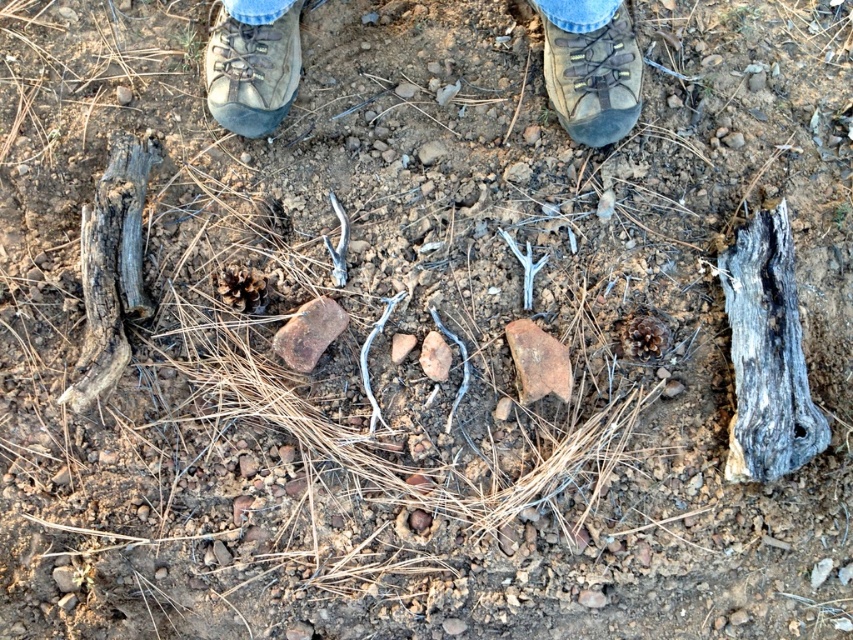
You are wearing the brown leather boots at center and want to pick up the gray weathered log at left. Can you reach it without moving your feet?

The gray weathered log at left is behind the brown leather boots at center, so you cannot reach it without moving your feet because it is out of your immediate reach from your current position.

You are standing at the camera position and see the gray weathered log at left. If you take a step forward, will the log be closer to you?

The gray weathered log at left is 5.66 feet away from the camera. If you step forward, you will be closer to the log, so yes, the log will appear closer to you.

You are a hiker who wants to place a small backpack between the brown leather boots at center and the gray weathered log at left. The backpack is 3 feet long. Will there be enough space between the two objects to fit it?

The distance between the brown leather boots at center and the gray weathered log at left is 39.36 inches, which is equivalent to 3.28 feet. Since the backpack is 3 feet long, there is enough space to fit it between the two objects.